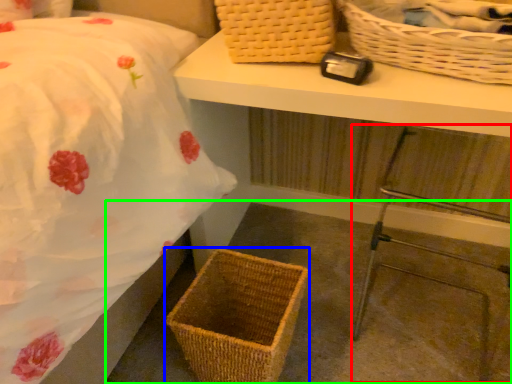
Question: Which is farther away from step stool (highlighted by a red box)? picnic basket (highlighted by a blue box) or concrete (highlighted by a green box)?

Choices:
 (A) picnic basket
 (B) concrete

Answer: (A)